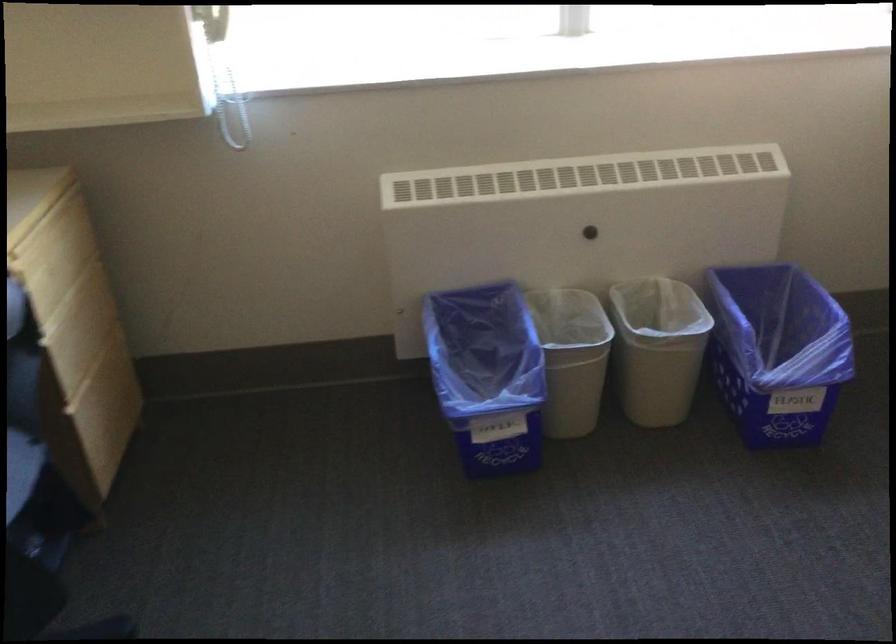
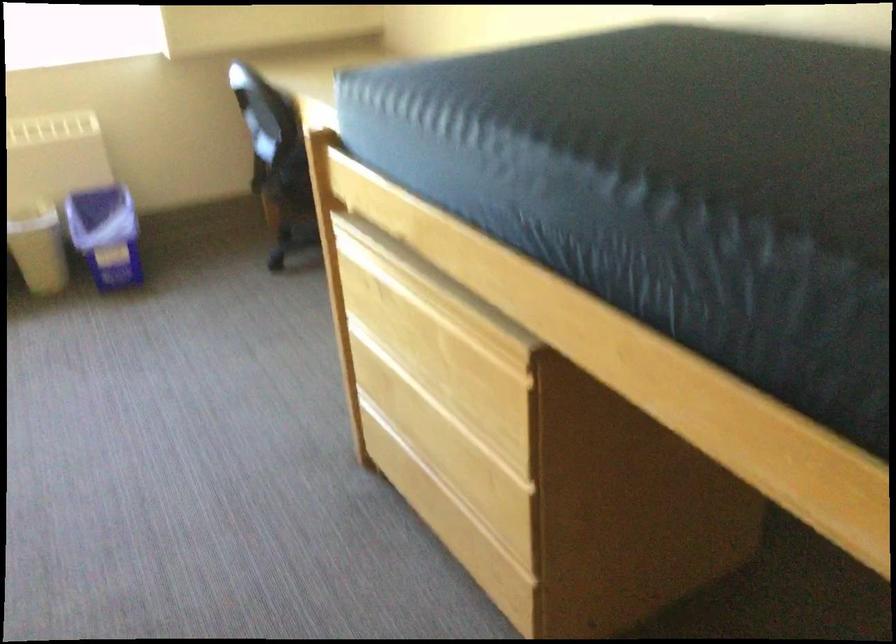
Which direction would the cameraman need to move to produce the second image?

The movement direction of the cameraman is right, backward.